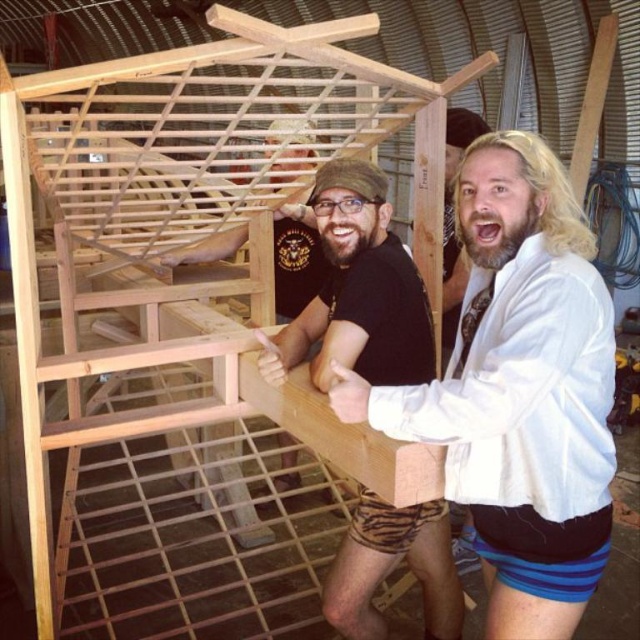
Is white matte jacket at upper right taller than black matte t-shirt at center?

Correct, white matte jacket at upper right is much taller as black matte t-shirt at center.

Who is lower down, white matte jacket at upper right or black matte t-shirt at center?

white matte jacket at upper right is below.

Is point (497, 349) less distant than point (406, 276)?

Yes, it is in front of point (406, 276).

Where is `white matte jacket at upper right`? The image size is (640, 640). white matte jacket at upper right is located at coordinates (518, 388).